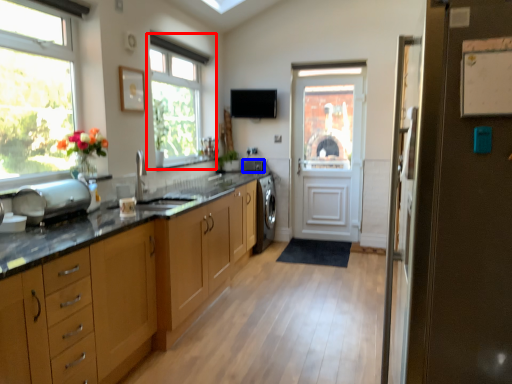
Question: Which object appears closest to the camera in this image, window (highlighted by a red box) or appliance (highlighted by a blue box)?

Choices:
 (A) window
 (B) appliance

Answer: (A)